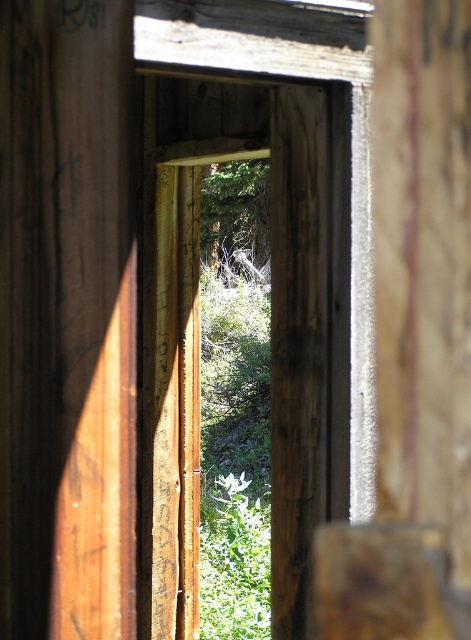
Question: Among these points, which one is nearest to the camera?

Choices:
 (A) (243, 220)
 (B) (343, 141)

Answer: (B)

Question: Which of the following is the closest to the observer?

Choices:
 (A) (221, 268)
 (B) (148, 285)

Answer: (B)

Question: Where is weathered wood frame at center located in relation to green leafy tree at center in the image?

Choices:
 (A) left
 (B) right

Answer: (A)

Question: Can you confirm if weathered wood frame at center is positioned to the left of green leafy tree at center?

Choices:
 (A) yes
 (B) no

Answer: (A)

Question: Is weathered wood frame at center in front of green leafy tree at center?

Choices:
 (A) no
 (B) yes

Answer: (B)